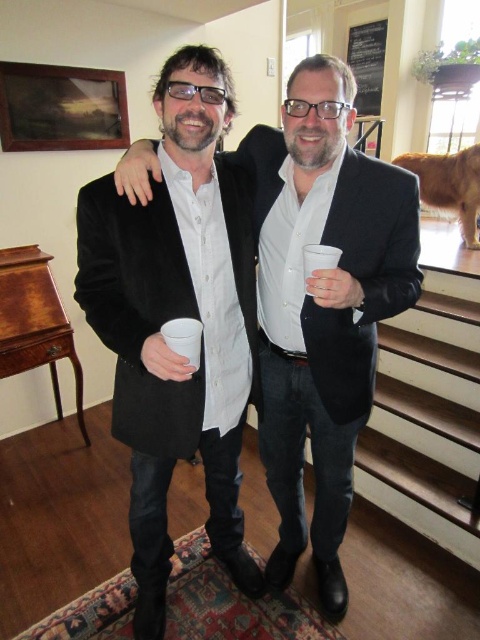
Who is taller, matte black suit at center or white styrofoam cup at center?

Standing taller between the two is matte black suit at center.

Is point (287, 182) closer to viewer compared to point (309, 294)?

No, (287, 182) is further to viewer.

Where is `matte black suit at center`? This screenshot has height=640, width=480. matte black suit at center is located at coordinates (323, 305).

Is white paper cup at center to the left of white styrofoam cup at center from the viewer's perspective?

Correct, you'll find white paper cup at center to the left of white styrofoam cup at center.

Is white paper cup at center closer to the viewer compared to white styrofoam cup at center?

Yes.

Who is more distant from viewer, (168, 333) or (335, 262)?

Positioned behind is point (335, 262).

Identify the location of white paper cup at center. Image resolution: width=480 pixels, height=640 pixels. (183, 339).

Who is higher up, matte black coat at center or white styrofoam cup at center?

white styrofoam cup at center is higher up.

Does matte black coat at center appear on the left side of white styrofoam cup at center?

Yes, matte black coat at center is to the left of white styrofoam cup at center.

Is point (146, 360) farther from viewer compared to point (323, 244)?

No, (146, 360) is closer to viewer.

Where is `matte black coat at center`? The height and width of the screenshot is (640, 480). matte black coat at center is located at coordinates (177, 317).